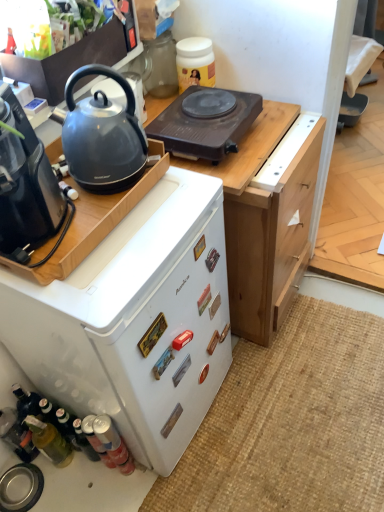
Question: Is brown plastic electric hot plate at upper center not inside matte black coffee maker at left, which ranks as the 2th kitchen appliance in top-to-bottom order?

Choices:
 (A) yes
 (B) no

Answer: (A)

Question: Is brown plastic electric hot plate at upper center aimed at matte black coffee maker at left, acting as the second kitchen appliance starting from the bottom?

Choices:
 (A) no
 (B) yes

Answer: (A)

Question: Is matte black coffee maker at left, acting as the second kitchen appliance starting from the bottom, at the back of brown plastic electric hot plate at upper center?

Choices:
 (A) yes
 (B) no

Answer: (B)

Question: Are brown plastic electric hot plate at upper center and matte black coffee maker at left, acting as the second kitchen appliance starting from the bottom, making contact?

Choices:
 (A) yes
 (B) no

Answer: (B)

Question: From a real-world perspective, is brown plastic electric hot plate at upper center on matte black coffee maker at left, acting as the second kitchen appliance starting from the bottom?

Choices:
 (A) no
 (B) yes

Answer: (A)

Question: Is brown plastic electric hot plate at upper center at the left side of matte black coffee maker at left, which ranks as the 2th kitchen appliance in top-to-bottom order?

Choices:
 (A) no
 (B) yes

Answer: (A)

Question: Can you confirm if metallic silver sink at lower left, the 3th kitchen appliance in the top-to-bottom sequence, is taller than matte black kettle at left?

Choices:
 (A) yes
 (B) no

Answer: (B)

Question: Considering the relative sizes of metallic silver sink at lower left, the 1th kitchen appliance ordered from the bottom, and matte black kettle at left in the image provided, is metallic silver sink at lower left, the 1th kitchen appliance ordered from the bottom, wider than matte black kettle at left?

Choices:
 (A) no
 (B) yes

Answer: (A)

Question: From a real-world perspective, does metallic silver sink at lower left, the 1th kitchen appliance ordered from the bottom, sit lower than matte black kettle at left?

Choices:
 (A) yes
 (B) no

Answer: (A)

Question: From the image's perspective, is metallic silver sink at lower left, the 3th kitchen appliance in the top-to-bottom sequence, located beneath matte black kettle at left?

Choices:
 (A) no
 (B) yes

Answer: (B)

Question: Is metallic silver sink at lower left, the 1th kitchen appliance ordered from the bottom, outside matte black kettle at left?

Choices:
 (A) yes
 (B) no

Answer: (A)

Question: Is metallic silver sink at lower left, the 1th kitchen appliance ordered from the bottom, bigger than matte black kettle at left?

Choices:
 (A) no
 (B) yes

Answer: (A)

Question: Is brown plastic electric hot plate at upper center touching metallic silver sink at lower left, the 1th kitchen appliance ordered from the bottom?

Choices:
 (A) yes
 (B) no

Answer: (B)